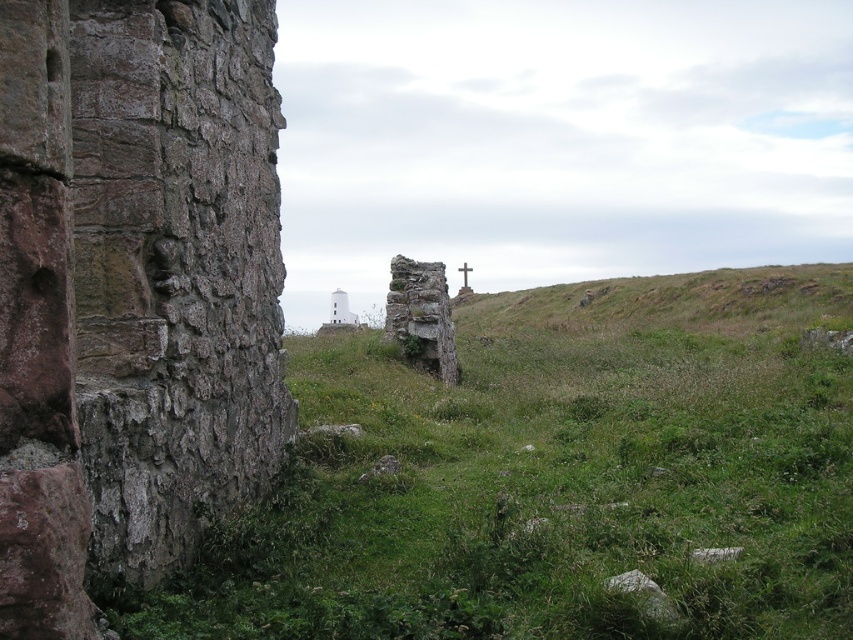
You are standing in the middle of the field and see both the green grassy at center and the white smooth tower at center. Which object is closer to you?

The green grassy at center is closer to you because it is in front of the white smooth tower at center.

You are standing at point A, which is at coordinates (x=132, y=291). You want to walk towards the rusty stone wall at left. Is the rusty stone wall at left in the direction you are facing?

Yes, the rusty stone wall at left is located at point A, so you are facing directly towards it.